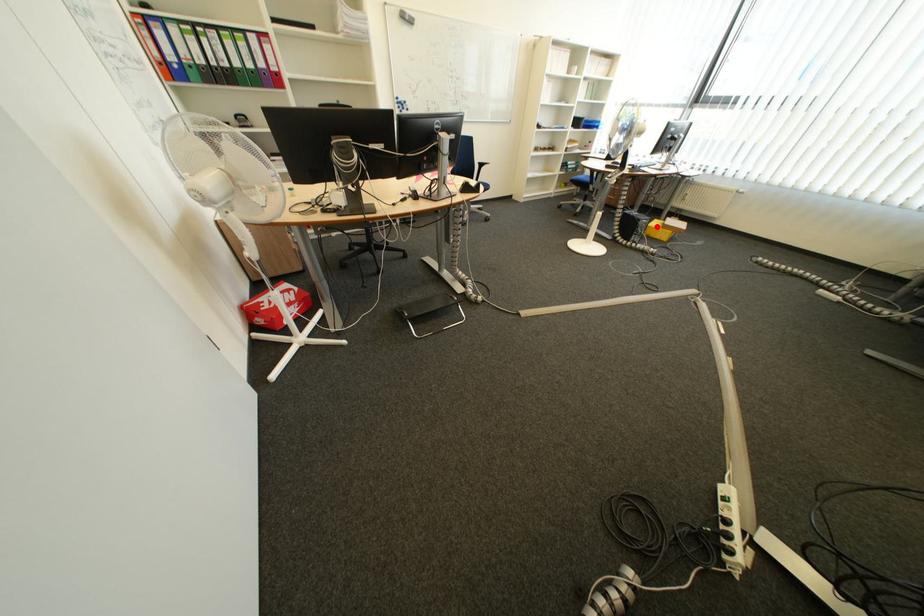
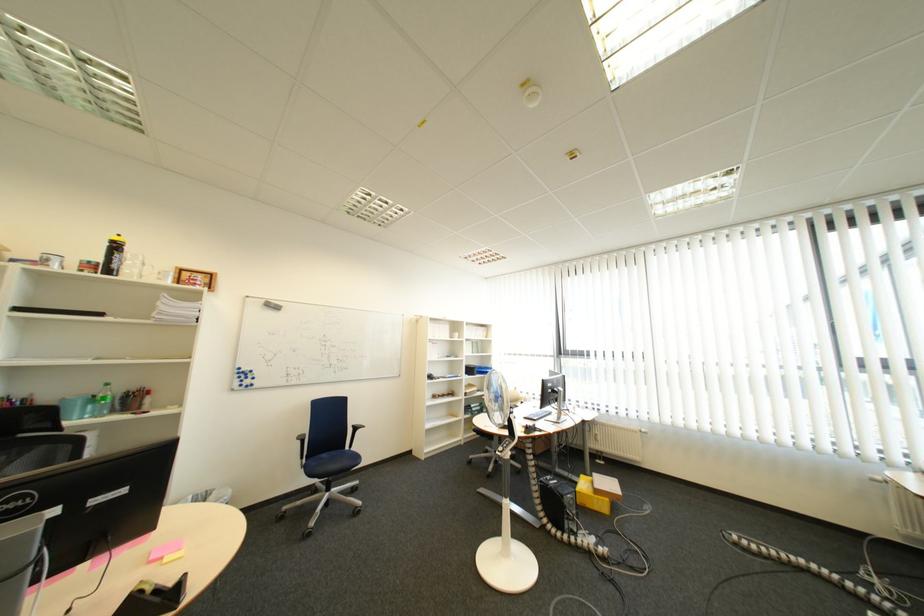
Question: I am providing you with two images of the same scene from different viewpoints. A red point is shown in image1. For the corresponding object point in image2, is it positioned nearer or farther from the camera?

Choices:
 (A) Nearer
 (B) Farther

Answer: (B)